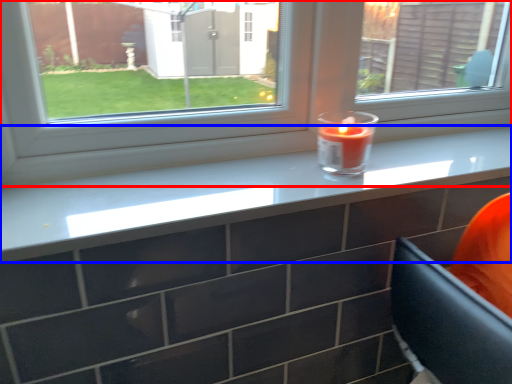
Question: Which object is closer to the camera taking this photo, window (highlighted by a red box) or counter top (highlighted by a blue box)?

Choices:
 (A) window
 (B) counter top

Answer: (B)